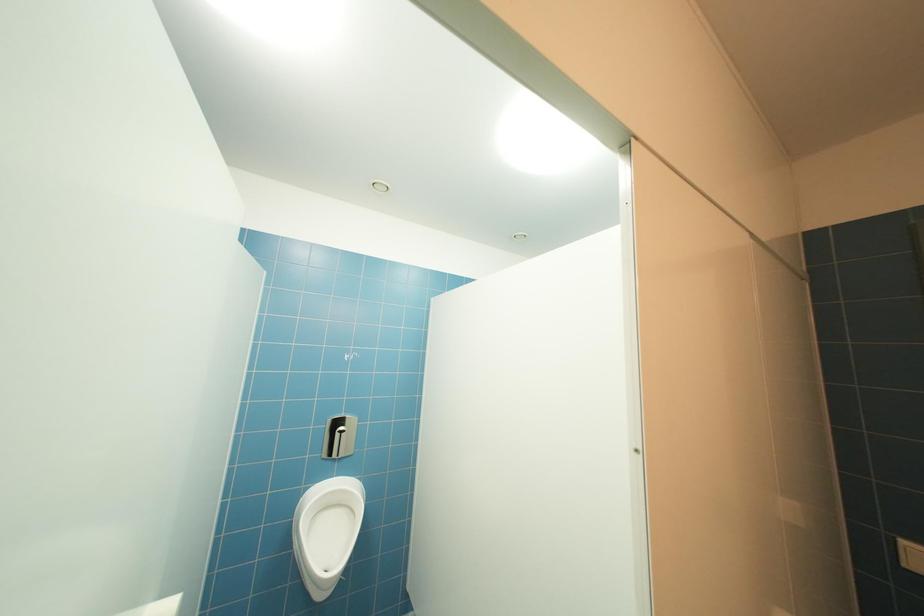
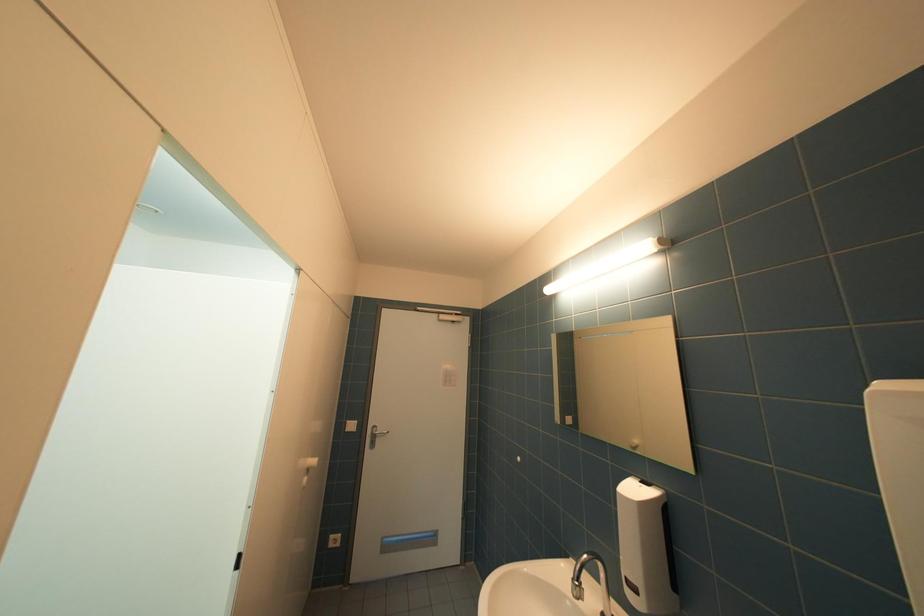
Question: How did the camera likely rotate?

Choices:
 (A) Left
 (B) Right
 (C) Up
 (D) Down

Answer: (B)